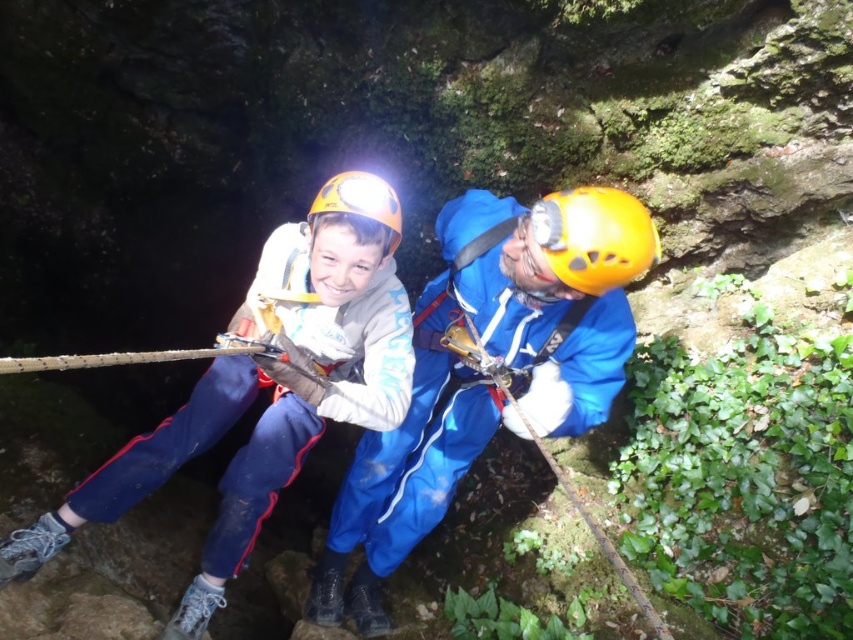
Question: Which of these objects is positioned closest to the matte blue jumpsuit at center?

Choices:
 (A) matte yellow helmet at center
 (B) blue fabric helmet at center

Answer: (B)

Question: Which object is farther from the camera taking this photo?

Choices:
 (A) blue fabric helmet at center
 (B) matte yellow helmet at center
 (C) matte blue jumpsuit at center

Answer: (B)

Question: Does matte blue jumpsuit at center appear on the right side of matte yellow helmet at center?

Choices:
 (A) no
 (B) yes

Answer: (A)

Question: Which of the following is the farthest from the observer?

Choices:
 (A) click(643, 211)
 (B) click(289, 483)
 (C) click(344, 524)

Answer: (C)

Question: From the image, what is the correct spatial relationship of blue fabric helmet at center in relation to yellow matte helmet at center?

Choices:
 (A) left
 (B) right

Answer: (A)

Question: Does matte blue jumpsuit at center appear on the left side of matte yellow helmet at center?

Choices:
 (A) no
 (B) yes

Answer: (B)